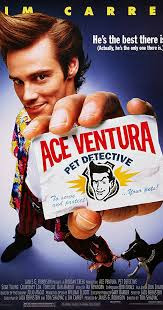
Identify the location of movie poster. The image size is (163, 310). (83, 115).